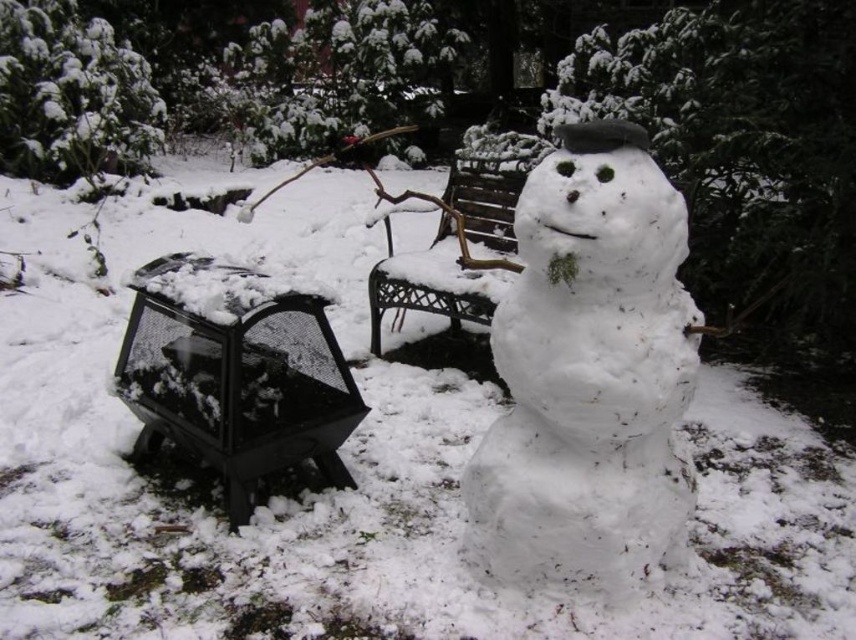
Question: Among these objects, which one is nearest to the camera?

Choices:
 (A) metallic brown bench at center
 (B) black mesh fire pit at lower left
 (C) white fluffy snowman at center

Answer: (C)

Question: In this image, where is white fluffy snowman at center located relative to black mesh fire pit at lower left?

Choices:
 (A) right
 (B) left

Answer: (A)

Question: Based on their relative distances, which object is farther from the white fluffy snowman at center?

Choices:
 (A) black mesh fire pit at lower left
 (B) metallic brown bench at center

Answer: (B)

Question: Which of these objects is positioned farthest from the black mesh fire pit at lower left?

Choices:
 (A) white fluffy snowman at center
 (B) metallic brown bench at center

Answer: (B)

Question: Can you confirm if black mesh fire pit at lower left is smaller than metallic brown bench at center?

Choices:
 (A) no
 (B) yes

Answer: (B)

Question: Can you confirm if white fluffy snowman at center is positioned above black mesh fire pit at lower left?

Choices:
 (A) yes
 (B) no

Answer: (A)